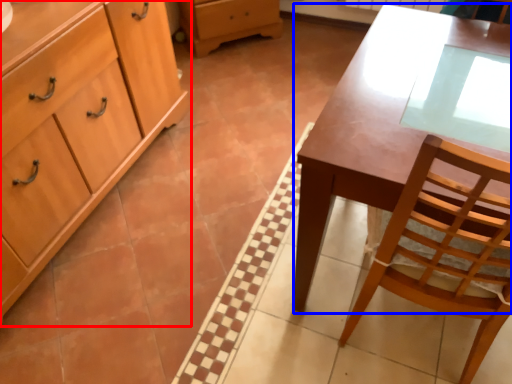
Question: Which point is closer to the camera, cabinetry (highlighted by a red box) or desk (highlighted by a blue box)?

Choices:
 (A) cabinetry
 (B) desk

Answer: (B)